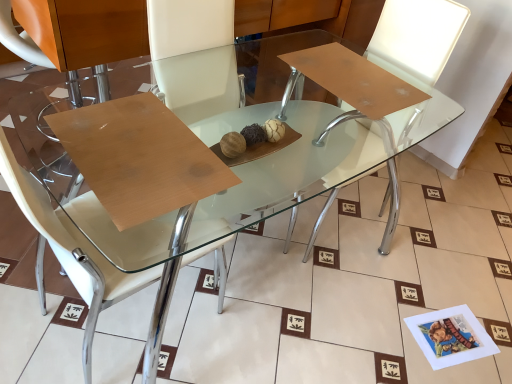
Question: Is wooden at center oriented towards white leather chair at center, which is counted as the second chair, starting from the right?

Choices:
 (A) no
 (B) yes

Answer: (B)

Question: Can you confirm if wooden at center is smaller than white leather chair at center, the first chair in the left-to-right sequence?

Choices:
 (A) yes
 (B) no

Answer: (A)

Question: Is wooden at center in contact with white leather chair at center, which is counted as the second chair, starting from the right?

Choices:
 (A) yes
 (B) no

Answer: (B)

Question: From the image's perspective, is wooden at center located beneath white leather chair at center, the first chair in the left-to-right sequence?

Choices:
 (A) no
 (B) yes

Answer: (A)

Question: Does wooden at center have a lesser width compared to white leather chair at center, the first chair in the left-to-right sequence?

Choices:
 (A) yes
 (B) no

Answer: (A)

Question: From a real-world perspective, is wooden at center on white leather chair at center, which is counted as the second chair, starting from the right?

Choices:
 (A) yes
 (B) no

Answer: (A)

Question: Is white leather chair at center, the first chair in the left-to-right sequence, not inside wooden at center?

Choices:
 (A) no
 (B) yes

Answer: (B)

Question: From a real-world perspective, is white leather chair at center, the first chair in the left-to-right sequence, below wooden at center?

Choices:
 (A) no
 (B) yes

Answer: (B)

Question: Is white leather chair at center, the first chair in the left-to-right sequence, positioned before wooden at center?

Choices:
 (A) yes
 (B) no

Answer: (A)

Question: Is white leather chair at center, which is counted as the second chair, starting from the right, positioned behind wooden at center?

Choices:
 (A) yes
 (B) no

Answer: (B)

Question: Does white leather chair at center, the first chair in the left-to-right sequence, appear on the left side of wooden at center?

Choices:
 (A) no
 (B) yes

Answer: (B)

Question: Is white leather chair at center, the first chair in the left-to-right sequence, looking in the opposite direction of wooden at center?

Choices:
 (A) yes
 (B) no

Answer: (A)

Question: Is white leather chair at center, which ranks as the first chair in right-to-left order, next to white leather chair at center, the first chair in the left-to-right sequence?

Choices:
 (A) yes
 (B) no

Answer: (B)